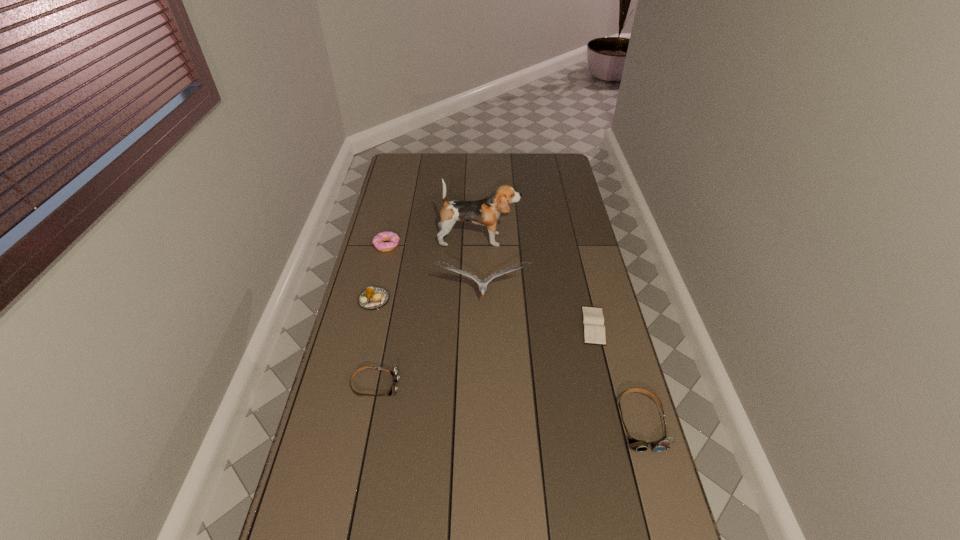
The image size is (960, 540). In order to click on free space located 0.090m on the back of the doughnut in this screenshot , I will do `click(392, 224)`.

Find the location of `vacant space located at the face of the tallest object`. vacant space located at the face of the tallest object is located at coordinates (531, 239).

Where is `free space located 0.310m on the left of the diary`? This screenshot has width=960, height=540. free space located 0.310m on the left of the diary is located at coordinates (490, 326).

This screenshot has height=540, width=960. I want to click on vacant space located 0.230m on the right of the pastry, so click(453, 300).

Locate an element on the screen. This screenshot has height=540, width=960. free space located at the tip of the beak of the second tallest object is located at coordinates (483, 338).

Where is `goggles at the left edge`? goggles at the left edge is located at coordinates (395, 373).

You are a GUI agent. You are given a task and a screenshot of the screen. Output one action in this format:
    pyautogui.click(x=<x>, y=<y>)
    Task: Click on the doughnut situated at the left edge
    
    Given the screenshot: What is the action you would take?
    pyautogui.click(x=378, y=241)

Identify the location of pastry positioned at the left edge. (372, 298).

You are a GUI agent. You are given a task and a screenshot of the screen. Output one action in this format:
    pyautogui.click(x=<x>, y=<y>)
    Task: Click on the goggles present at the right edge
    Image resolution: width=960 pixels, height=540 pixels.
    Given the screenshot: What is the action you would take?
    pyautogui.click(x=638, y=445)

In order to click on diary located at the right edge in this screenshot , I will do `click(593, 320)`.